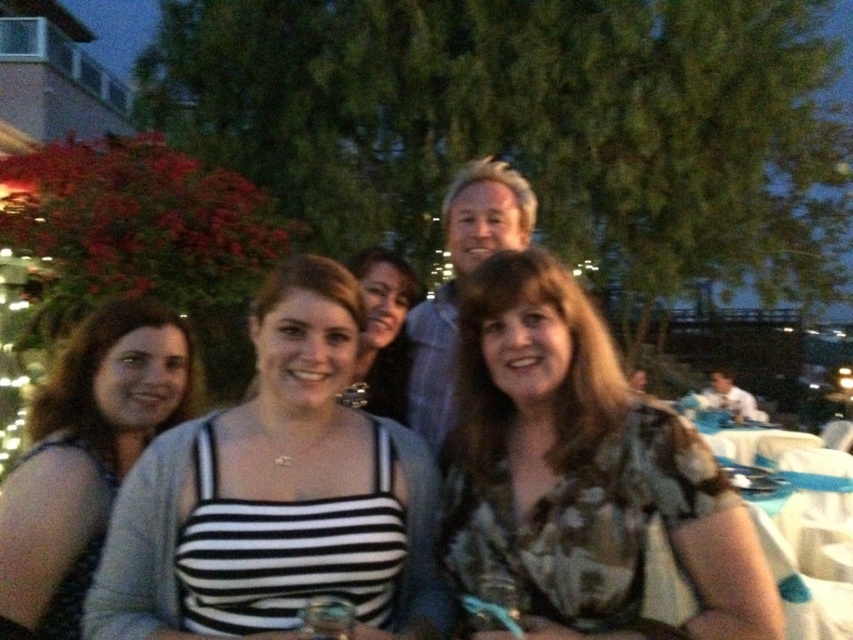
You are standing at point (68, 378) and want to walk to the string lights in the background. Is the point (544, 474) blocking your path?

Point (544, 474) is in front of point (68, 378), so yes, the point (544, 474) is blocking your path to the string lights in the background.